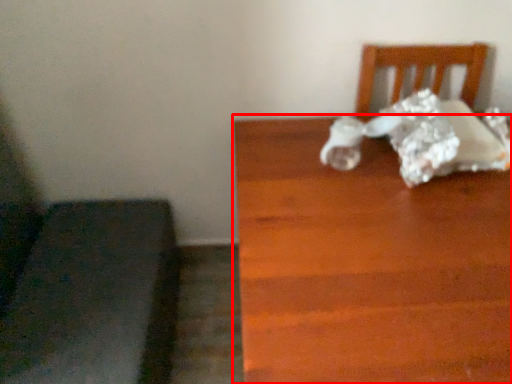
Question: From the image's perspective, where is table (annotated by the red box) located relative to furniture?

Choices:
 (A) below
 (B) above

Answer: (B)